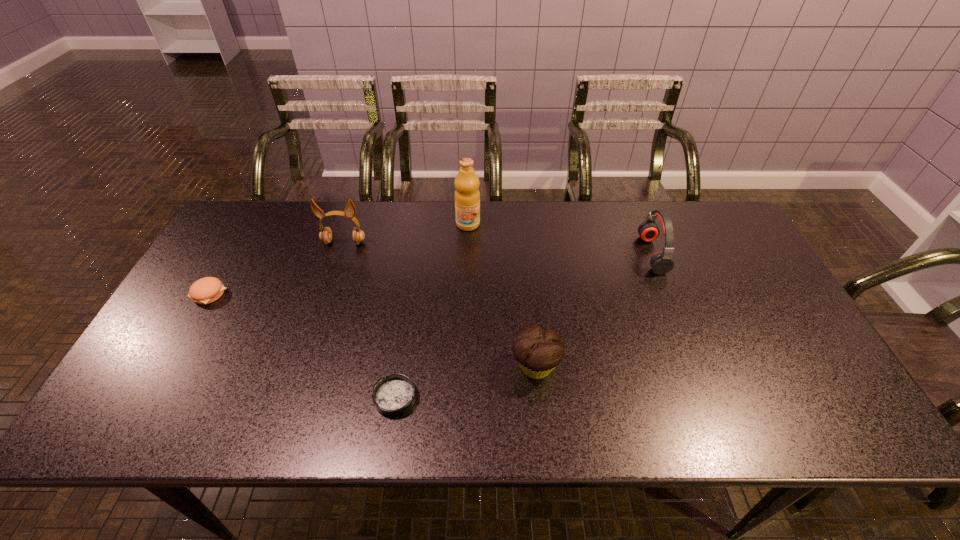
Locate an element on the screen. vacant area that lies between the fruit juice and the fifth object from right to left is located at coordinates (406, 233).

You are a GUI agent. You are given a task and a screenshot of the screen. Output one action in this format:
    pyautogui.click(x=<x>, y=<y>)
    Task: Click on the vacant point located between the shorter earphone and the second object from right to left
    The width and height of the screenshot is (960, 540).
    Given the screenshot: What is the action you would take?
    pyautogui.click(x=594, y=310)

Locate an element on the screen. The height and width of the screenshot is (540, 960). free area in between the left earphone and the farthest object is located at coordinates (406, 233).

The height and width of the screenshot is (540, 960). What are the coordinates of `free space that is in between the second object from left to right and the third shortest object` in the screenshot? It's located at (440, 305).

I want to click on blank region between the leftmost object and the third tallest object, so click(431, 274).

Identify the location of free space between the fifth object from right to left and the fourth object from right to left. The width and height of the screenshot is (960, 540). (370, 320).

The image size is (960, 540). In order to click on vacant area that lies between the muffin and the fifth object from right to left in this screenshot , I will do `click(440, 305)`.

Find the location of a particular element. free point between the third object from right to left and the muffin is located at coordinates (502, 295).

Select which object is the second closest to the fourth tallest object. Please provide its 2D coordinates. Your answer should be formatted as a tuple, i.e. [(x, y)], where the tuple contains the x and y coordinates of a point satisfying the conditions above.

[(661, 263)]

Find the location of a particular element. object that is the third closest to the second object from right to left is located at coordinates (467, 196).